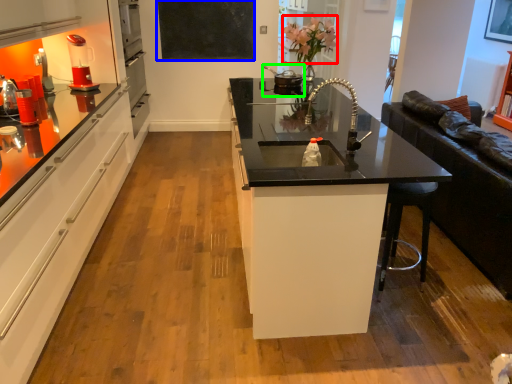
Question: Based on their relative distances, which object is farther from flower (highlighted by a red box)? Choose from bulletin board (highlighted by a blue box) and appliance (highlighted by a green box).

Choices:
 (A) bulletin board
 (B) appliance

Answer: (A)